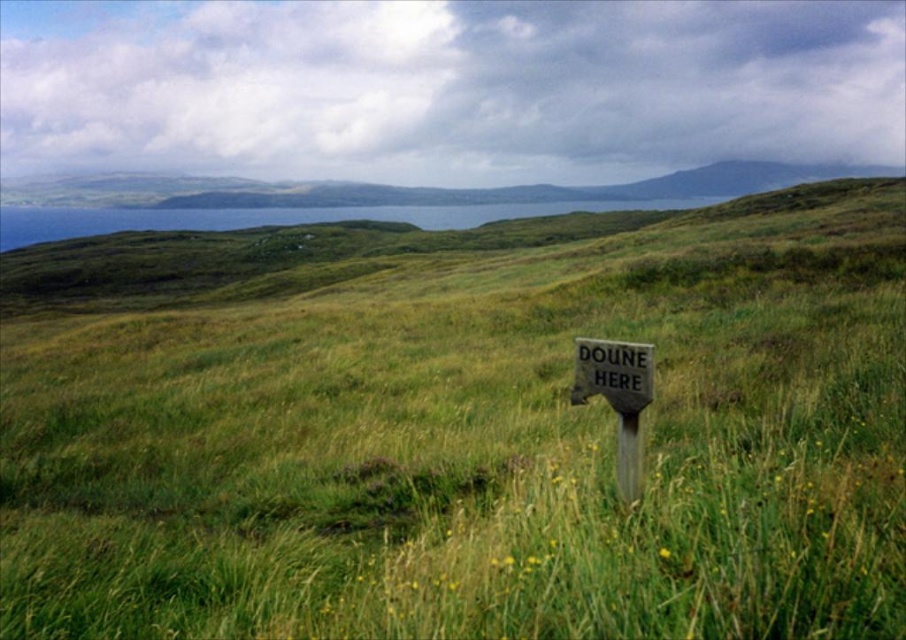
You are standing in the middle of the green grassy at center and want to walk towards the wooden signpost at center. Which direction should you move?

Since the green grassy at center is to the right of the wooden signpost at center, you should move to the left to reach the wooden signpost at center.

In the scene shown: You are a hiker trying to navigate through the green grassy at center and wooden signpost at center. Which object is taller and could potentially block your view of the distant mountains?

The green grassy at center is much taller than the wooden signpost at center, so it could potentially block your view of the distant mountains.